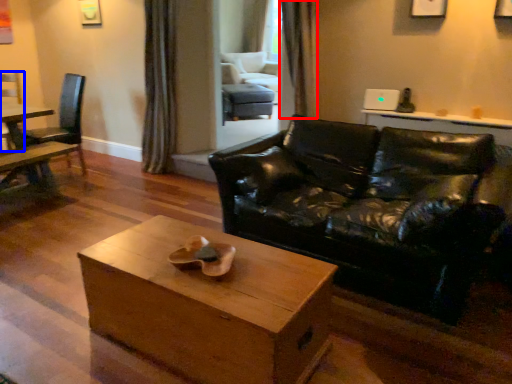
Question: Which object appears closest to the camera in this image, curtain (highlighted by a red box) or chair (highlighted by a blue box)?

Choices:
 (A) curtain
 (B) chair

Answer: (A)